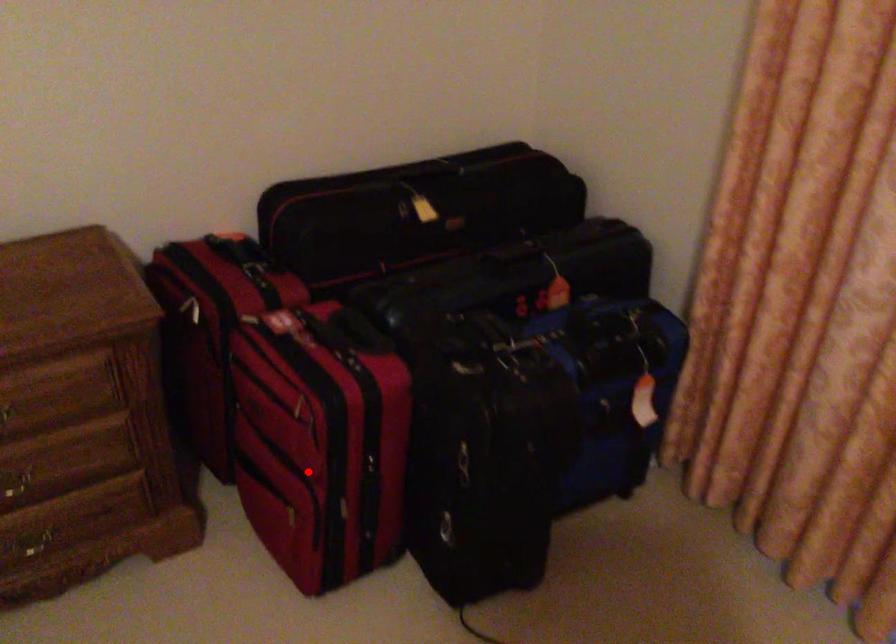
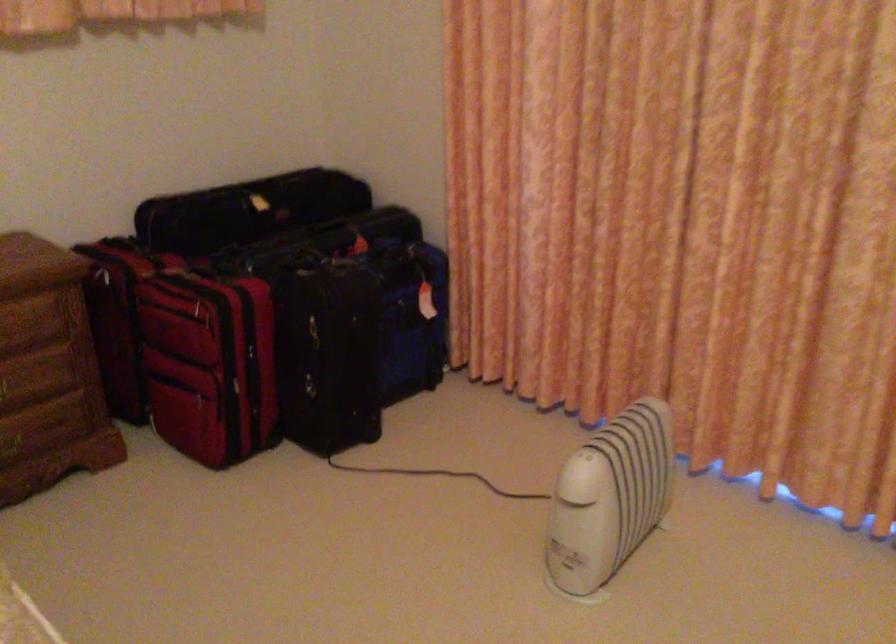
Question: I am providing you with two images of the same scene from different viewpoints. Given a red point in image1, look at the same physical point in image2. Is it:

Choices:
 (A) Closer to the viewpoint
 (B) Farther from the viewpoint

Answer: (B)